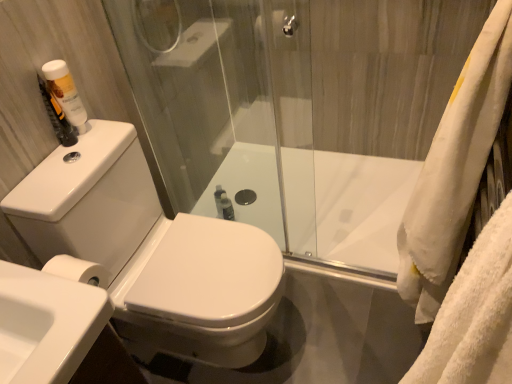
You are a GUI agent. You are given a task and a screenshot of the screen. Output one action in this format:
    pyautogui.click(x=<x>, y=<y>)
    Task: Click on the vacant area in front of white plastic bottle at upper left
    The image size is (512, 384).
    Given the screenshot: What is the action you would take?
    pyautogui.click(x=64, y=157)